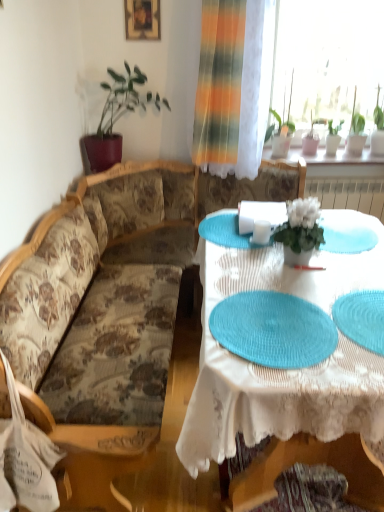
At what (x,y) coordinates should I click in order to perform the action: click on free space to the left of blue woven placemat at lower right. Please return your answer as a coordinate pair (x, y). The width and height of the screenshot is (384, 512). Looking at the image, I should click on (292, 329).